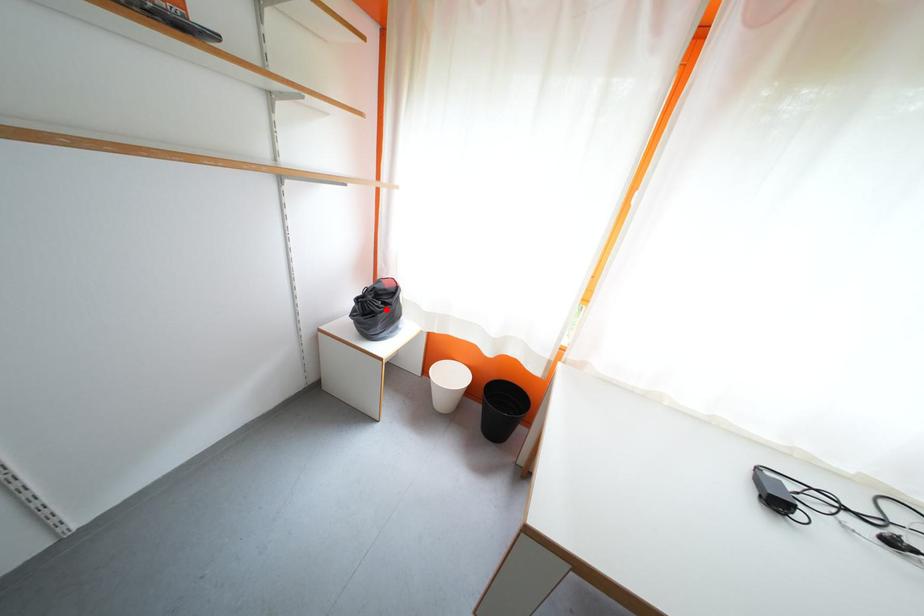
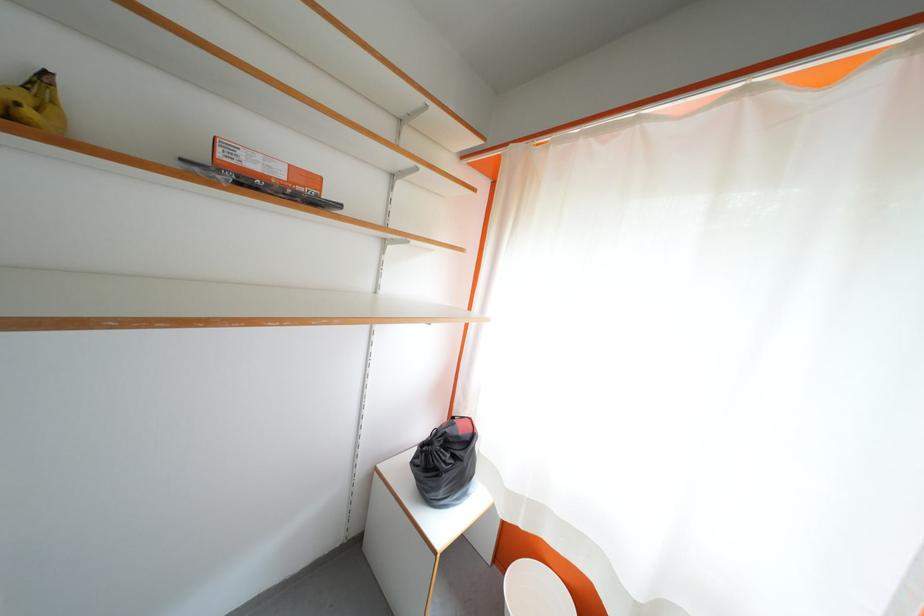
Question: I am providing you with two images of the same scene from different viewpoints. A red point is shown in image1. For the corresponding object point in image2, is it positioned nearer or farther from the camera?

Choices:
 (A) Nearer
 (B) Farther

Answer: (B)